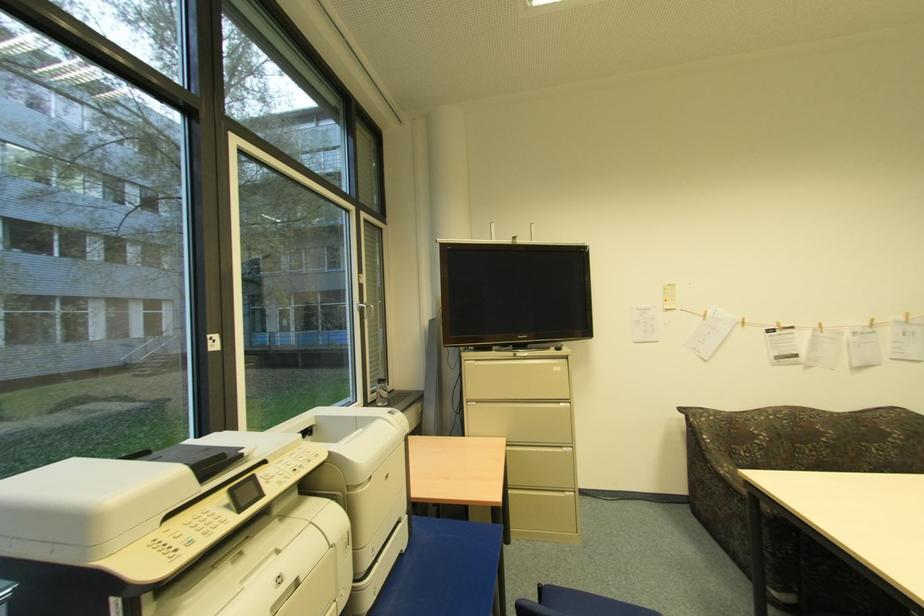
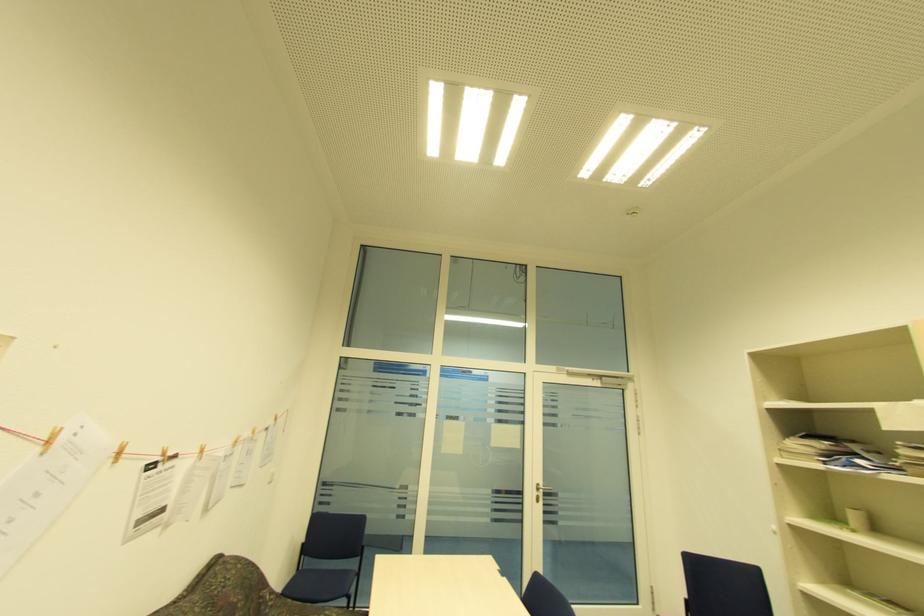
Find the pixel in the second image that matches pixel 708 315 in the first image.

(51, 444)